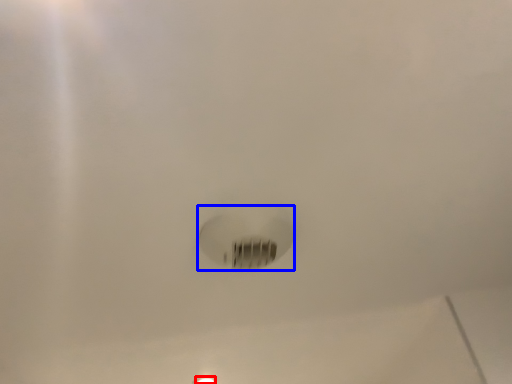
Question: Which object is closer to the camera taking this photo, light fixture (highlighted by a red box) or light bulb (highlighted by a blue box)?

Choices:
 (A) light fixture
 (B) light bulb

Answer: (B)